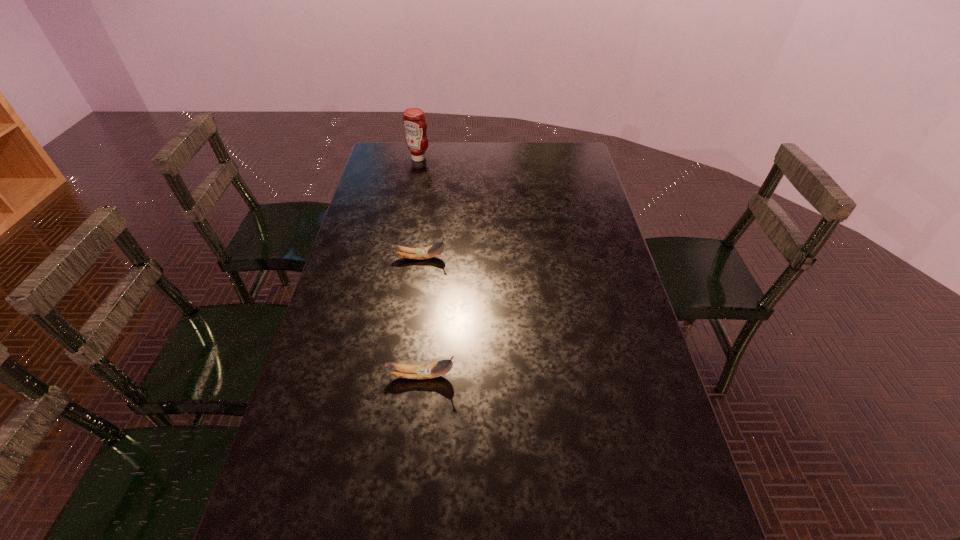
Image resolution: width=960 pixels, height=540 pixels. In order to click on object that is the closest to the nearest object in this screenshot , I will do `click(427, 252)`.

Identify which object is the second closest to the farther banana. Please provide its 2D coordinates. Your answer should be formatted as a tuple, i.e. [(x, y)], where the tuple contains the x and y coordinates of a point satisfying the conditions above.

[(414, 121)]